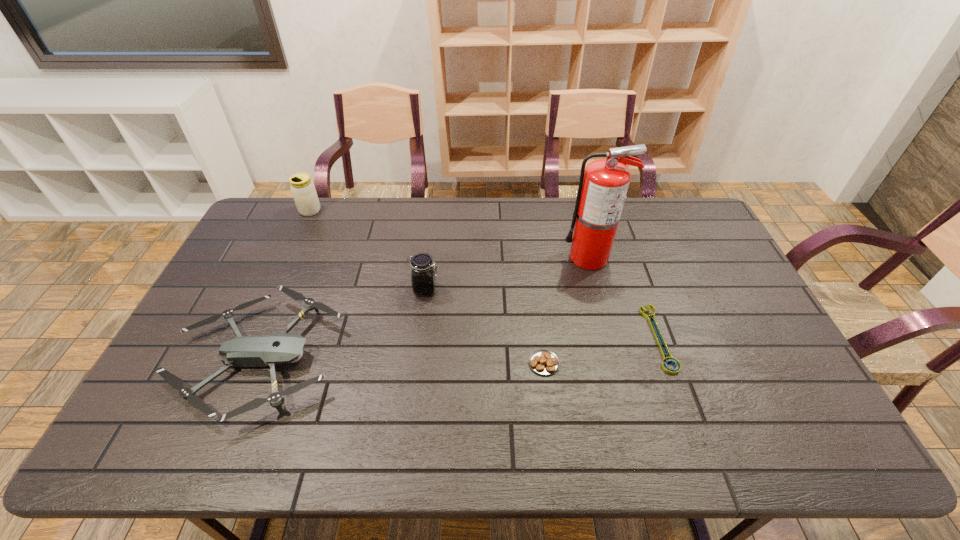
What are the coordinates of `free area in between the drone and the fire extinguisher` in the screenshot? It's located at (423, 308).

You are a GUI agent. You are given a task and a screenshot of the screen. Output one action in this format:
    pyautogui.click(x=<x>, y=<y>)
    Task: Click on the free space between the farther jar and the shortest object
    This screenshot has height=540, width=960.
    Given the screenshot: What is the action you would take?
    pyautogui.click(x=484, y=274)

The height and width of the screenshot is (540, 960). What are the coordinates of `vacant space that is in between the third object from right to left and the drone` in the screenshot? It's located at (401, 361).

This screenshot has width=960, height=540. In order to click on vacant area that lies between the fifth object from left to right and the drone in this screenshot , I will do `click(423, 308)`.

Where is `blank region between the drone and the third object from right to left`? The height and width of the screenshot is (540, 960). blank region between the drone and the third object from right to left is located at coordinates (401, 361).

Where is `free spot between the drone and the nearer jar`? free spot between the drone and the nearer jar is located at coordinates tap(342, 324).

Where is `free space between the fourth nearest object and the pastry`? free space between the fourth nearest object and the pastry is located at coordinates (485, 326).

At what (x,y) coordinates should I click in order to perform the action: click on free space between the fire extinguisher and the fifth tallest object. Please return your answer as a coordinate pair (x, y). Image resolution: width=960 pixels, height=540 pixels. Looking at the image, I should click on (566, 310).

This screenshot has height=540, width=960. What are the coordinates of `free point between the fourth tallest object and the fourth object from right to left` in the screenshot? It's located at (342, 324).

Select which object appears as the second closest to the fifth object from left to right. Please provide its 2D coordinates. Your answer should be formatted as a tuple, i.e. [(x, y)], where the tuple contains the x and y coordinates of a point satisfying the conditions above.

[(544, 362)]